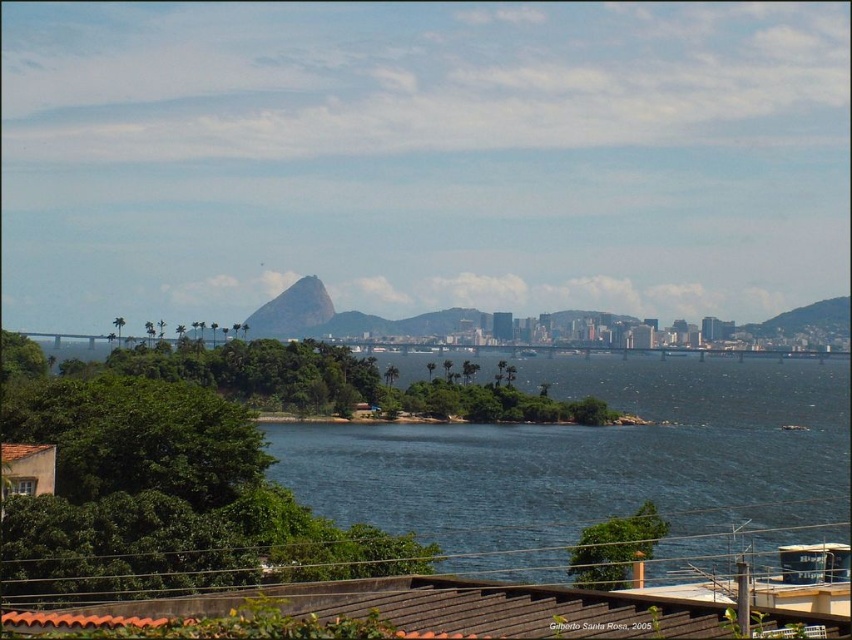
You are a drone operator planning to fly a drone between the blue water at center and the green rough rock at center. The drone has a maximum flight distance of 300 feet. Based on the scene, can the drone safely make the trip without exceeding its range?

The distance between the blue water at center and the green rough rock at center is 307.84 feet, which exceeds the drone operator maximum flight range of 300 feet. Therefore, the drone cannot safely make the trip without exceeding its range.

From the picture: You are a tourist standing in the coastal city of Rio de Janeiro, Brazil. You see the blue water at center and the green rough rock at center. Which object is located below the other?

The blue water at center is positioned under the green rough rock at center, so the blue water at center is below the green rough rock at center.

You are a photographer planning to capture the iconic Sugarloaf Mountain in the background with the blue water at center and green rough rock at center. Based on their positions, which object would appear closer to the camera in your photo?

The blue water at center appears closer to the camera because it is positioned in front of the green rough rock at center.